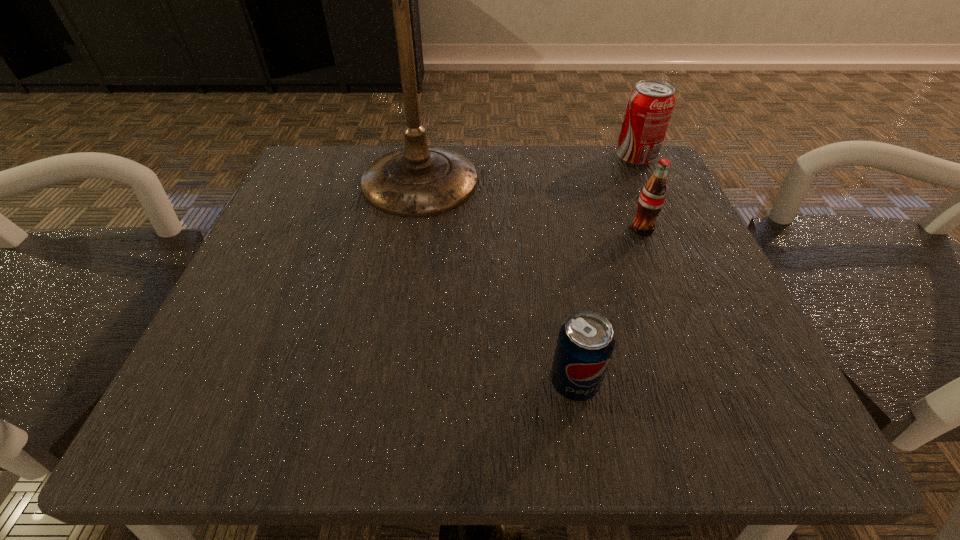
This screenshot has width=960, height=540. I want to click on the leftmost object, so click(x=417, y=181).

Locate an element on the screen. table lamp is located at coordinates click(417, 181).

The image size is (960, 540). I want to click on the farthest soda can, so click(650, 105).

This screenshot has height=540, width=960. I want to click on the second farthest soda can, so click(652, 198).

This screenshot has width=960, height=540. Identify the location of the leftmost soda can. (585, 344).

Where is `the nearest object`? This screenshot has height=540, width=960. the nearest object is located at coordinates (585, 344).

Locate an element on the screen. The image size is (960, 540). vacant space located 0.240m above the green lampshade of the leftmost object is located at coordinates (390, 368).

This screenshot has width=960, height=540. I want to click on blank space located 0.260m on the left of the farthest soda can, so click(x=492, y=158).

Where is `vacant space located on the back of the second farthest soda can`? This screenshot has height=540, width=960. vacant space located on the back of the second farthest soda can is located at coordinates (625, 186).

At what (x,y) coordinates should I click in order to perform the action: click on vacant space located 0.260m on the back of the shortest soda can. Please return your answer as a coordinate pair (x, y). The width and height of the screenshot is (960, 540). Looking at the image, I should click on (549, 234).